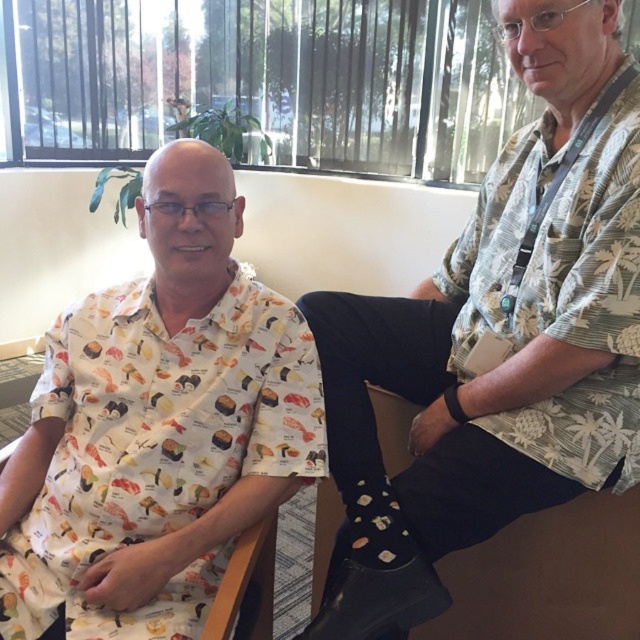
Question: Observing the image, what is the correct spatial positioning of white palm print shirt at center in reference to white printed shirt at center?

Choices:
 (A) above
 (B) below

Answer: (A)

Question: Which point is farther to the camera?

Choices:
 (A) white printed shirt at center
 (B) black fabric chair at lower right

Answer: (B)

Question: Does white palm print shirt at center have a lesser width compared to black fabric chair at lower right?

Choices:
 (A) no
 (B) yes

Answer: (A)

Question: Which object appears closest to the camera in this image?

Choices:
 (A) white palm print shirt at center
 (B) white printed shirt at center
 (C) black fabric chair at lower right
 (D) green palm tree print shirt at upper right

Answer: (A)

Question: Which point is farther from the camera taking this photo?

Choices:
 (A) (404, 339)
 (B) (589, 544)
 (C) (593, 147)

Answer: (A)

Question: Is black fabric chair at lower right below wooden chair at center?

Choices:
 (A) no
 (B) yes

Answer: (B)